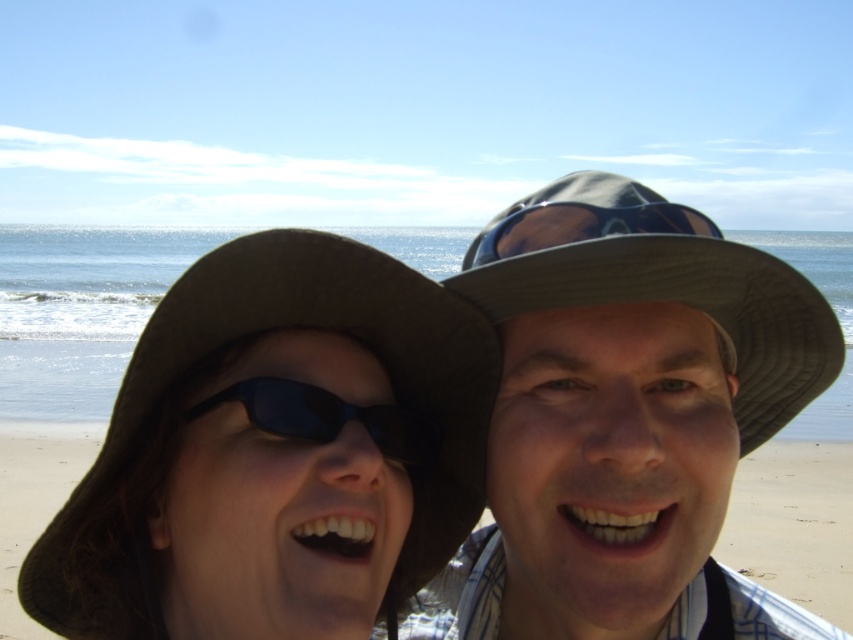
Question: Can you confirm if brown fabric cowboy hat at left is thinner than matte gray hat at center?

Choices:
 (A) no
 (B) yes

Answer: (A)

Question: Which object is farther from the camera taking this photo?

Choices:
 (A) brown fabric cowboy hat at left
 (B) black reflective sunglasses at center

Answer: (B)

Question: Which point is closer to the camera taking this photo?

Choices:
 (A) (323, 374)
 (B) (809, 500)
 (C) (292, 412)

Answer: (C)

Question: Can you confirm if matte gray hat at center is positioned to the left of matte blue goggles at upper center?

Choices:
 (A) no
 (B) yes

Answer: (A)

Question: From the image, what is the correct spatial relationship of beige sand at center in relation to black reflective sunglasses at center?

Choices:
 (A) above
 (B) below

Answer: (B)

Question: Estimate the real-world distances between objects in this image. Which object is farther from the matte blue goggles at upper center?

Choices:
 (A) brown fabric cowboy hat at left
 (B) beige sand at center

Answer: (B)